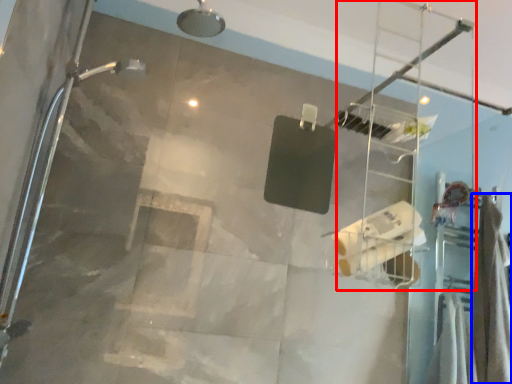
Question: Which of the following is the closest to the observer, ladder (highlighted by a red box) or shower curtain (highlighted by a blue box)?

Choices:
 (A) ladder
 (B) shower curtain

Answer: (A)